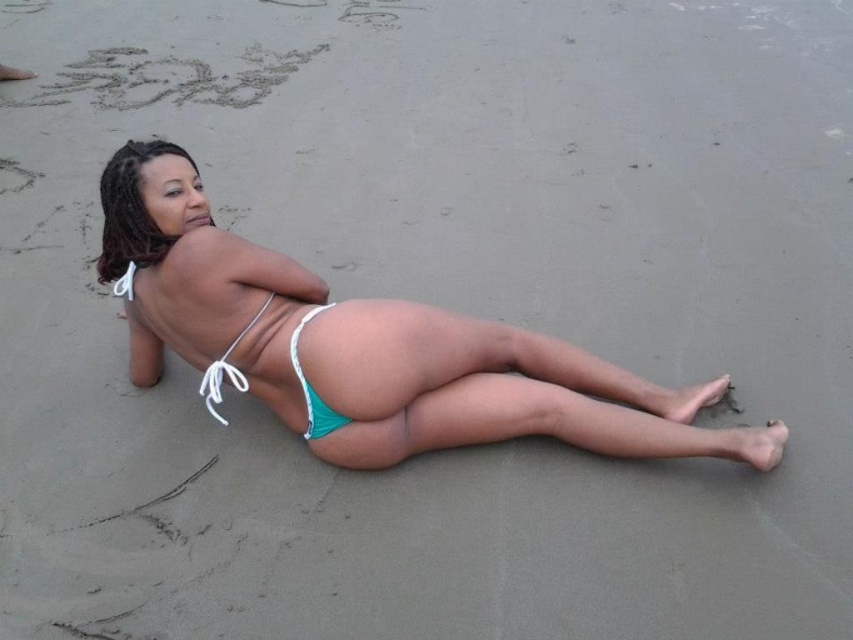
You are a photographer trying to capture the perfect shot of the person on the beach. You want to ensure that both the teal fabric bikini bottom at center and the matte white bikini top at upper left are clearly visible in your photo. Given their positions and sizes, which object should you focus on first to ensure both are in frame?

You should focus on the teal fabric bikini bottom at center first since it is much taller than the matte white bikini top at upper left, ensuring it fits within the frame while also capturing the smaller top.

You are a photographer trying to capture the perfect shot of the person on the beach. You need to ensure that both the matte white bikini top at upper left and the teal fabric bikini bottom at lower center are clearly visible in the frame. Based on their positions, which part of the bikini is covering the other?

The matte white bikini top at upper left is positioned over the teal fabric bikini bottom at lower center, so the white top is covering the teal bottom.

You are a photographer trying to capture the perfect shot of the beach scene. You need to focus on the teal fabric bikini bottom at center. Based on its position, can you determine if it is closer to the top or bottom of the image?

The teal fabric bikini bottom at center is located at point coordinates 0.613 on the x and 0.581 on the y. Since the y coordinate is 0.581, which is closer to 1, it means the bikini bottom is positioned closer to the bottom of the image.